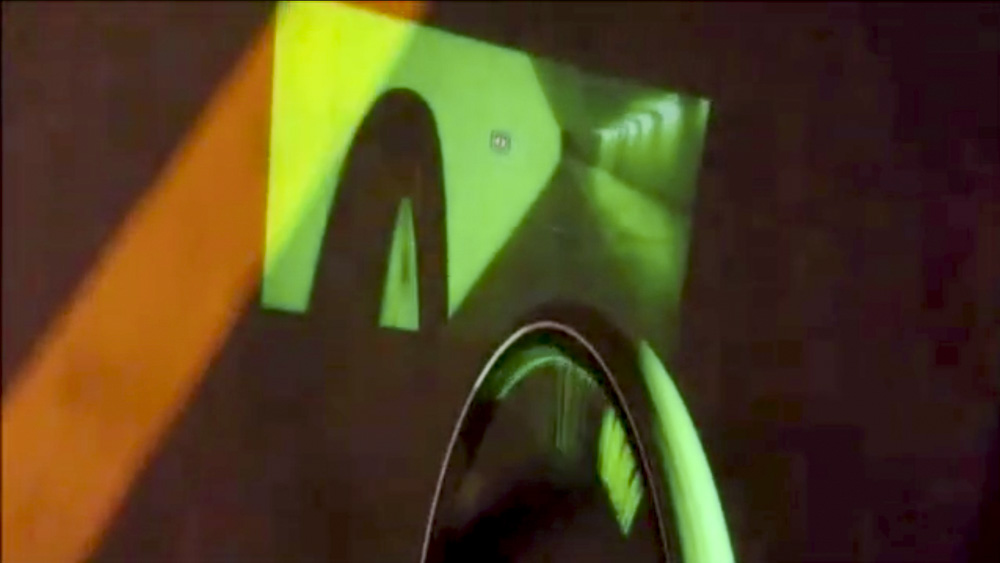
Locate an element on the screen. Image resolution: width=1000 pixels, height=563 pixels. lighter green floor color is located at coordinates (653, 226).